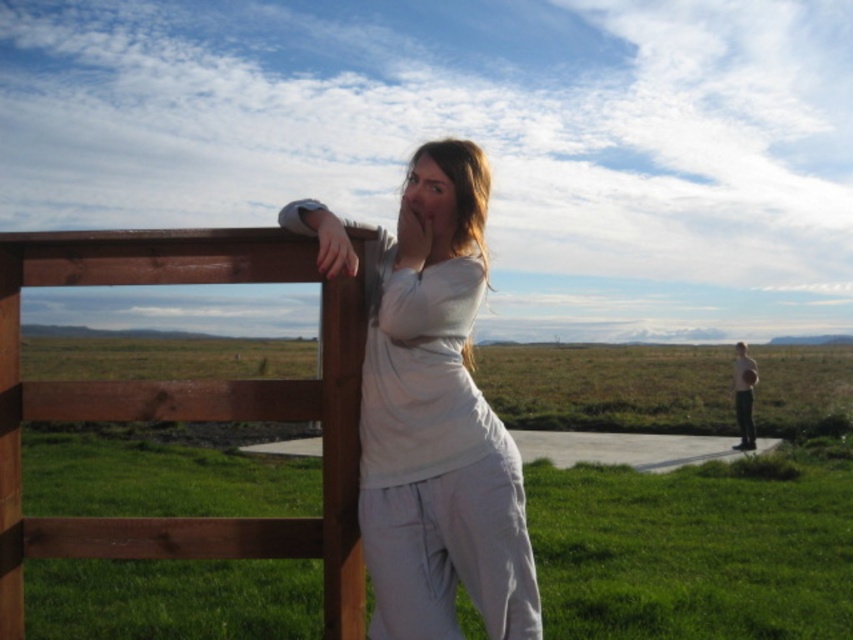
Question: Considering the real-world distances, which object is farthest from the green grass at center?

Choices:
 (A) white cotton shirt at center
 (B) light brown wooden fence at upper left
 (C) brown wooden fence at left

Answer: (B)

Question: Which of these objects is positioned closest to the green grass at center?

Choices:
 (A) brown wooden fence at left
 (B) light brown wooden fence at upper left
 (C) white cotton shirt at center

Answer: (C)

Question: Is white cotton shirt at center thinner than light brown wooden fence at upper left?

Choices:
 (A) yes
 (B) no

Answer: (A)

Question: Considering the relative positions of white cotton shirt at center and light brown wooden fence at upper left in the image provided, where is white cotton shirt at center located with respect to light brown wooden fence at upper left?

Choices:
 (A) right
 (B) left

Answer: (B)

Question: Among these points, which one is farthest from the camera?

Choices:
 (A) (752, 362)
 (B) (480, 512)
 (C) (352, 324)
 (D) (606, 552)

Answer: (A)

Question: Considering the relative positions of green grass at center and white cotton shirt at center in the image provided, where is green grass at center located with respect to white cotton shirt at center?

Choices:
 (A) right
 (B) left

Answer: (B)